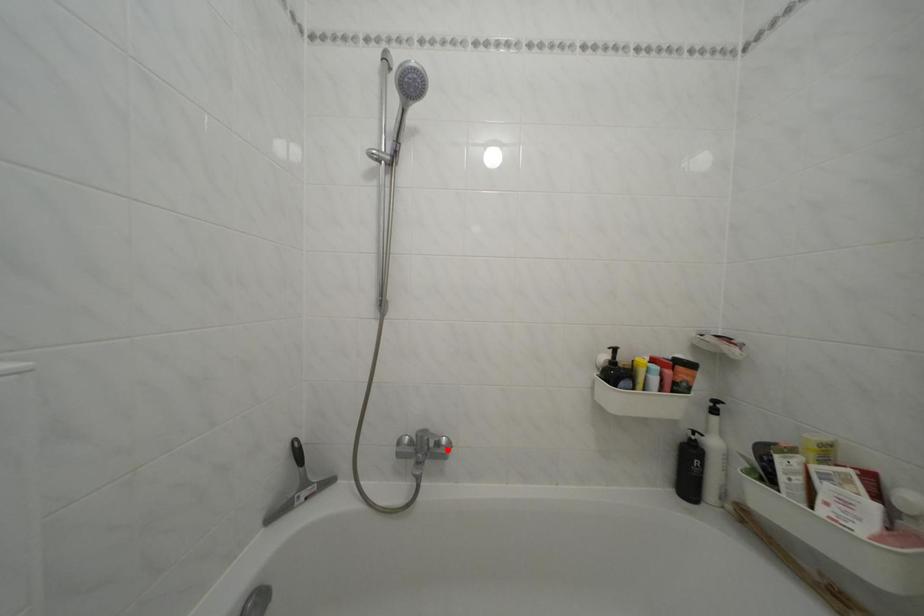
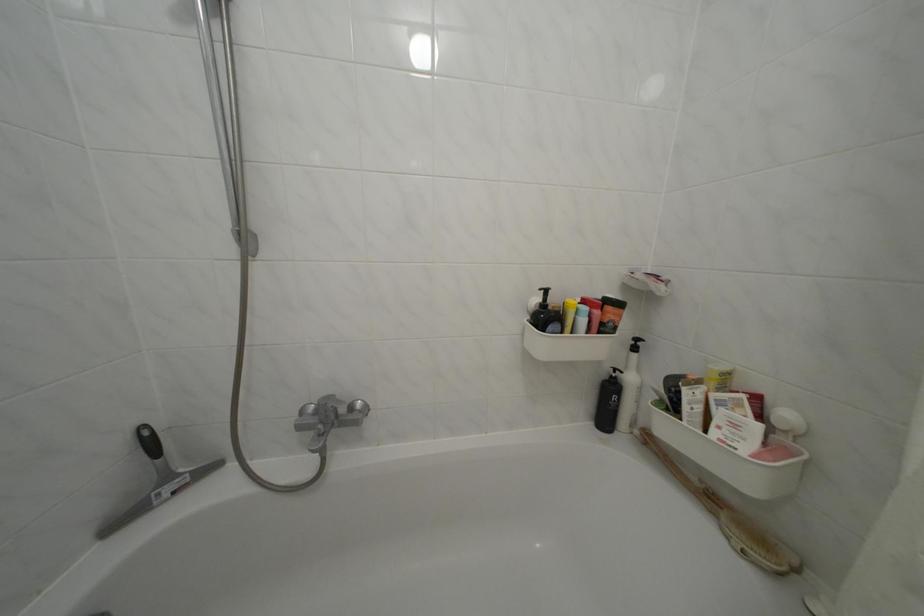
Find the pixel in the second image that matches the highlighted location in the first image.

(359, 414)